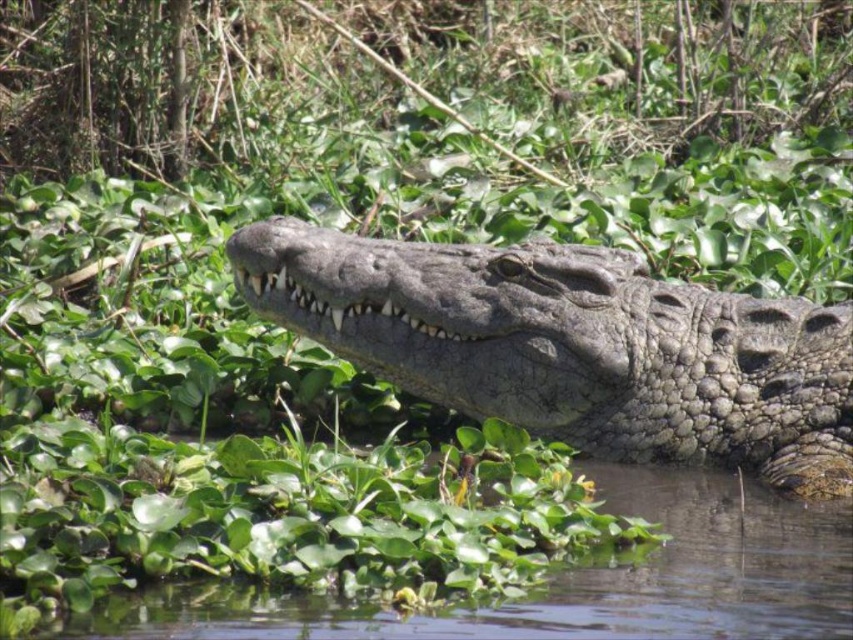
Does rough textured crocodile at center have a larger size compared to clear water at center?

No.

Can you confirm if rough textured crocodile at center is shorter than clear water at center?

Incorrect, rough textured crocodile at center's height does not fall short of clear water at center's.

I want to click on rough textured crocodile at center, so click(x=573, y=346).